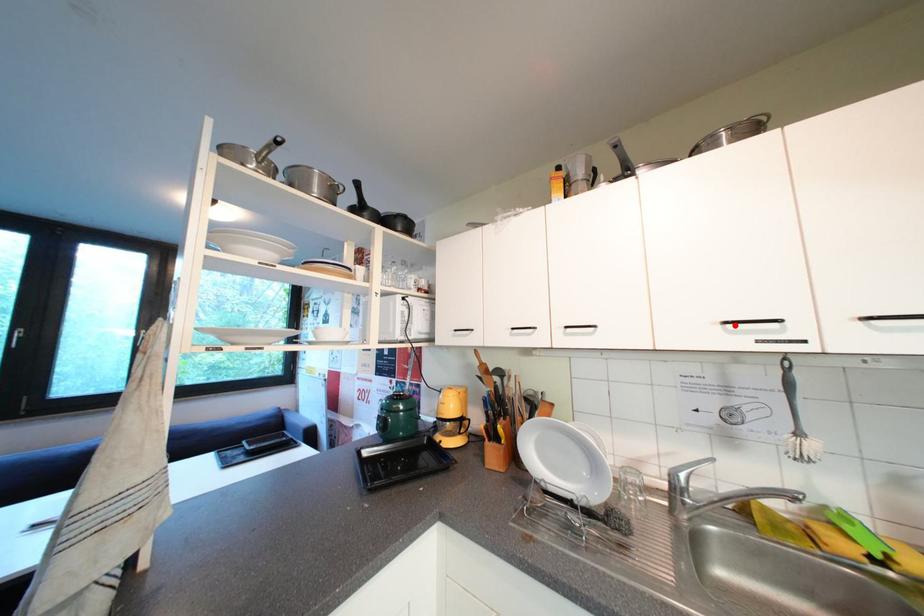
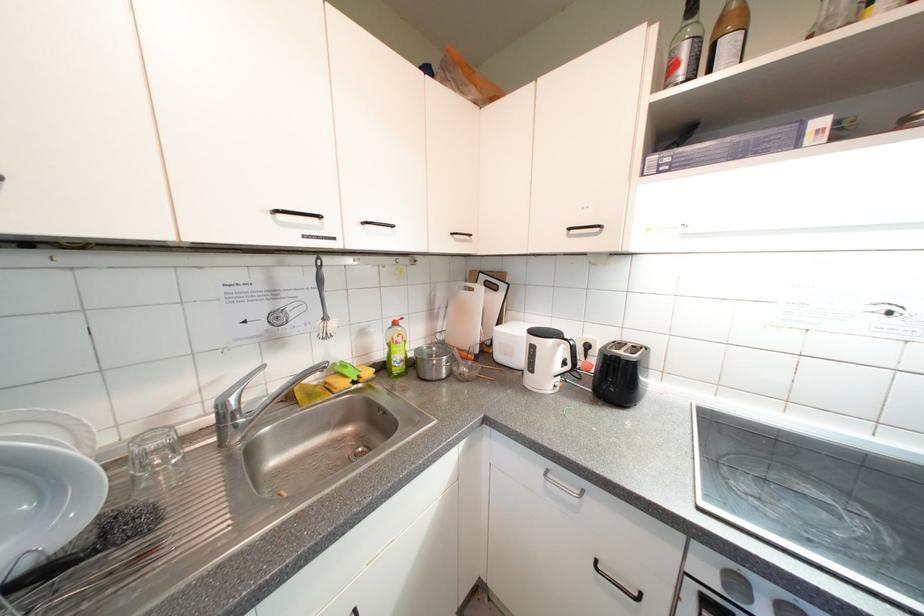
Find the pixel in the second image that matches the highlighted location in the first image.

(285, 214)